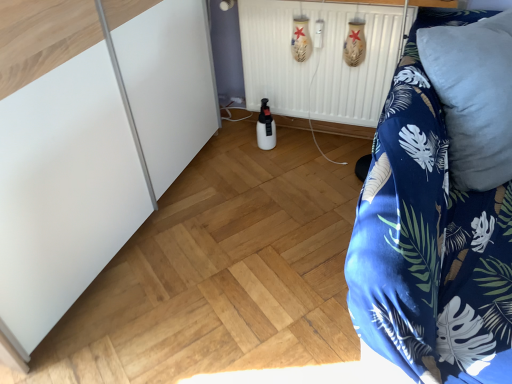
Question: Relative to white matte bottle at center, is blue soft pillow at right in front or behind?

Choices:
 (A) behind
 (B) front

Answer: (B)

Question: From a real-world perspective, is blue soft pillow at right physically located above or below white matte bottle at center?

Choices:
 (A) below
 (B) above

Answer: (B)

Question: Which object is positioned farthest from the white matte bottle at center?

Choices:
 (A) white matte radiator at center
 (B) blue soft pillow at right
 (C) blue floral fabric at right

Answer: (C)

Question: Which object is the closest to the blue soft pillow at right?

Choices:
 (A) white matte bottle at center
 (B) white matte radiator at center
 (C) blue floral fabric at right

Answer: (C)